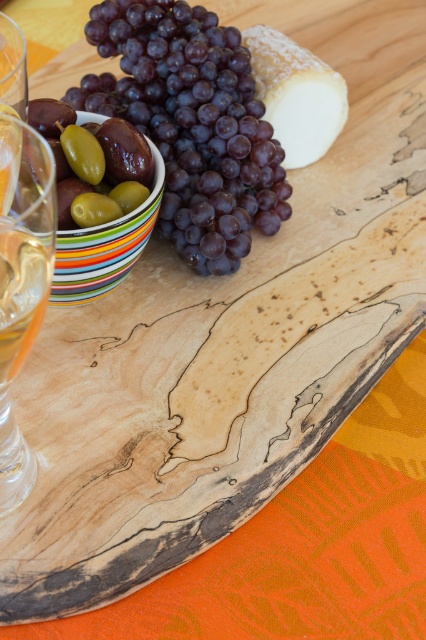
Does point (28, 321) come behind point (14, 333)?

Yes.

Measure the distance between clear glass wine glass at left and translucent glass at lower left.

A distance of 0.71 inches exists between clear glass wine glass at left and translucent glass at lower left.

This screenshot has width=426, height=640. Describe the element at coordinates (22, 282) in the screenshot. I see `clear glass wine glass at left` at that location.

This screenshot has height=640, width=426. Identify the location of clear glass wine glass at left. (22, 282).

What do you see at coordinates (22, 282) in the screenshot? I see `clear glass wine glass at left` at bounding box center [22, 282].

Is point (25, 180) farther from camera compared to point (94, 122)?

No.

Identify the location of clear glass wine glass at left. (22, 282).

Image resolution: width=426 pixels, height=640 pixels. In order to click on clear glass wine glass at left in this screenshot , I will do click(22, 282).

Who is taller, shiny purple grapes at upper left or green olive at center?

With more height is shiny purple grapes at upper left.

Can you confirm if shiny purple grapes at upper left is positioned below green olive at center?

No, shiny purple grapes at upper left is not below green olive at center.

Which is in front, point (281, 147) or point (94, 184)?

Point (94, 184)

You are a GUI agent. You are given a task and a screenshot of the screen. Output one action in this format:
    pyautogui.click(x=<x>, y=<y>)
    Task: Click on the shiny purple grapes at upper left
    The image size is (426, 640).
    Given the screenshot: What is the action you would take?
    pyautogui.click(x=192, y=124)